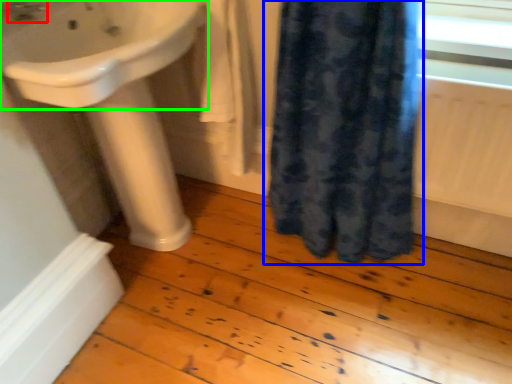
Question: Which object is the closest to the tap (highlighted by a red box)? Choose among these: curtain (highlighted by a blue box) or sink (highlighted by a green box).

Choices:
 (A) curtain
 (B) sink

Answer: (B)